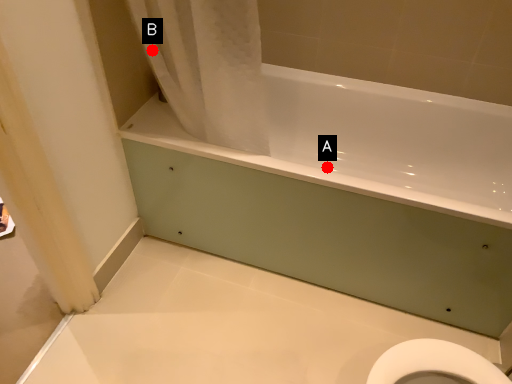
Question: Two points are circled on the image, labeled by A and B beside each circle. Which point is closer to the camera taking this photo?

Choices:
 (A) A is closer
 (B) B is closer

Answer: (B)